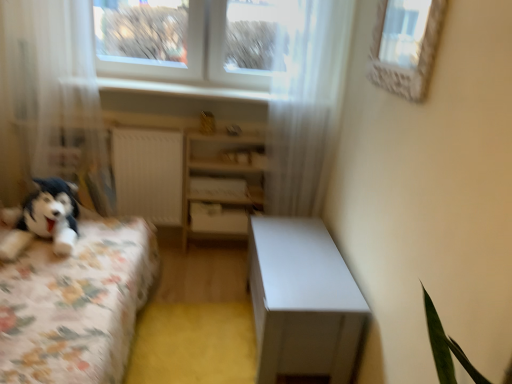
Where is `blank space to the left of white glossy table at center`? The height and width of the screenshot is (384, 512). blank space to the left of white glossy table at center is located at coordinates (206, 296).